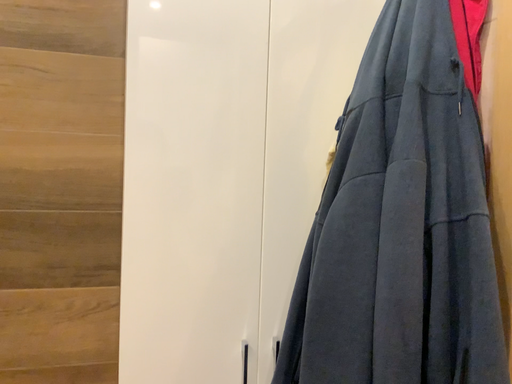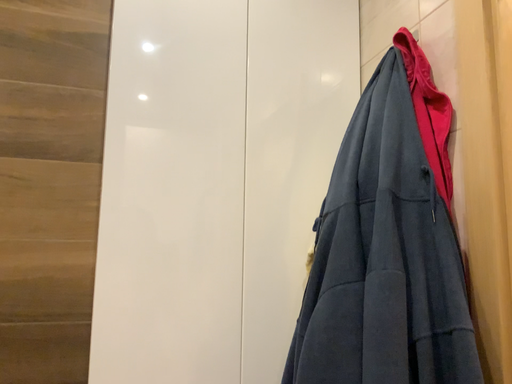
Question: Which way did the camera rotate in the video?

Choices:
 (A) rotated downward
 (B) rotated upward

Answer: (B)